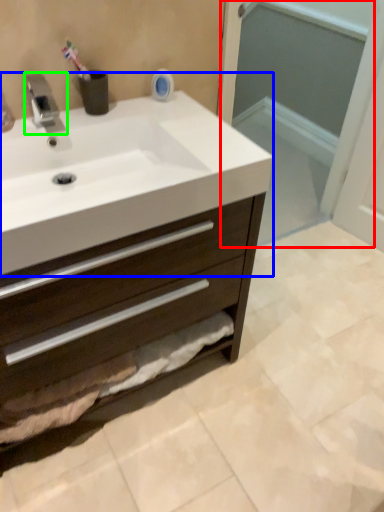
Question: Estimate the real-world distances between objects in this image. Which object is farther from screen door (highlighted by a red box), sink (highlighted by a blue box) or tap (highlighted by a green box)?

Choices:
 (A) sink
 (B) tap

Answer: (B)